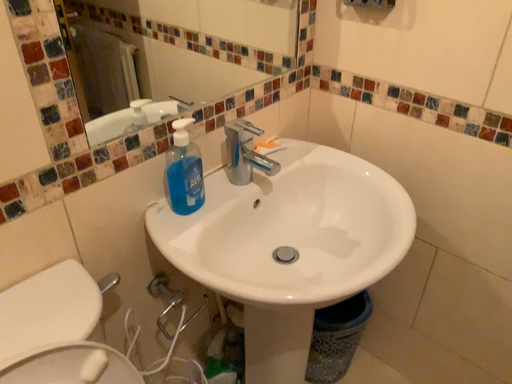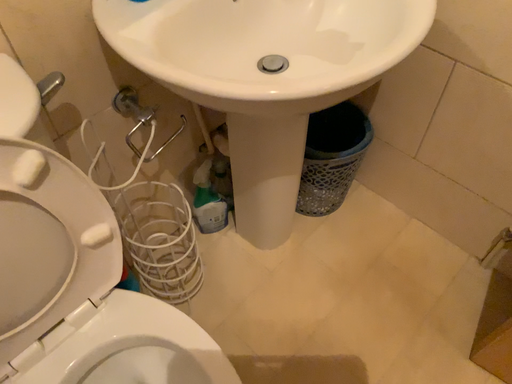
Question: How did the camera likely rotate when shooting the video?

Choices:
 (A) rotated downward
 (B) rotated upward

Answer: (A)